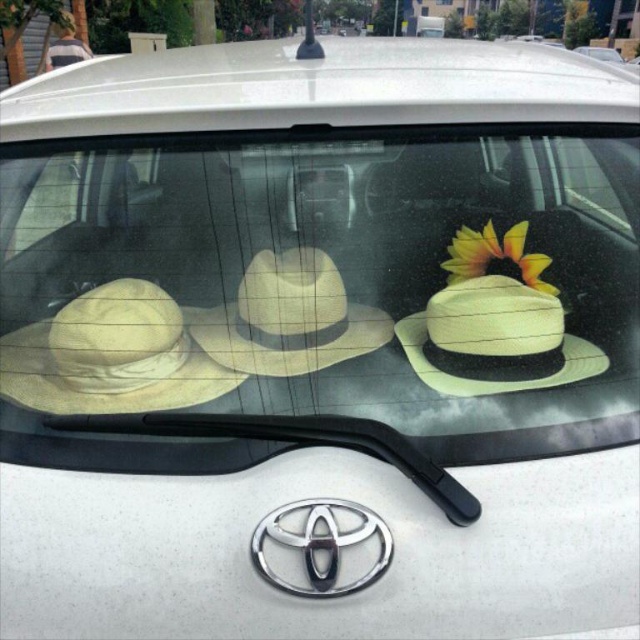
Question: Is beige straw cowboy hat at left smaller than yellow matte flower at upper right?

Choices:
 (A) no
 (B) yes

Answer: (A)

Question: Can you confirm if beige straw cowboy hat at left is positioned below yellow matte flower at upper right?

Choices:
 (A) no
 (B) yes

Answer: (B)

Question: Which point is farther to the camera?

Choices:
 (A) (60, 356)
 (B) (509, 250)
 (C) (204, 340)

Answer: (B)

Question: Which of these objects is positioned farthest from the beige straw hat at center?

Choices:
 (A) natural straw cowboy hat at center
 (B) yellow matte flower at upper right
 (C) beige straw cowboy hat at left

Answer: (C)

Question: Is beige straw hat at center thinner than yellow matte flower at upper right?

Choices:
 (A) yes
 (B) no

Answer: (B)

Question: Which of the following is the farthest from the observer?

Choices:
 (A) beige straw cowboy hat at left
 (B) natural straw cowboy hat at center
 (C) beige straw hat at center
 (D) yellow matte flower at upper right

Answer: (D)